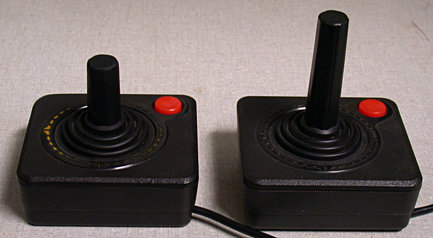
I want to click on controller wire, so click(x=219, y=216), click(x=425, y=211).